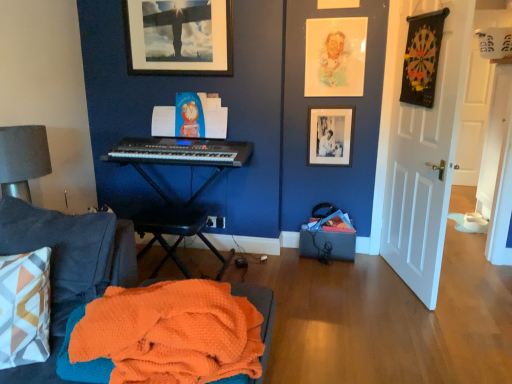
This screenshot has height=384, width=512. In order to click on vacant space that is in between black fabric box at lower right and black plastic keyboard at center in this screenshot , I will do `click(279, 266)`.